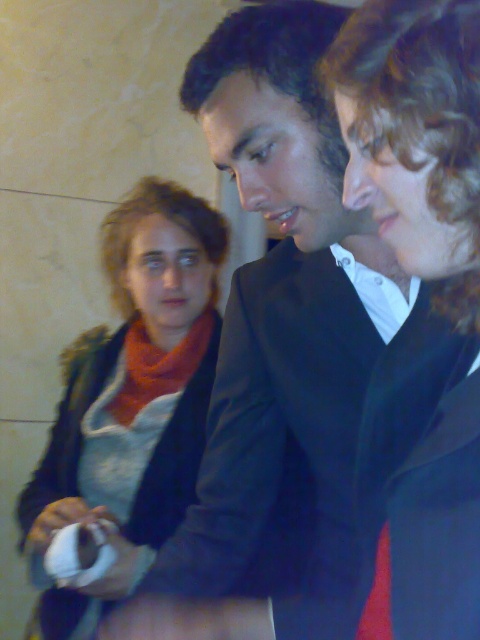
Question: From the image, what is the correct spatial relationship of matte black jacket at center in relation to matte orange scarf at upper left?

Choices:
 (A) above
 (B) below

Answer: (A)

Question: Which object is farther from the camera taking this photo?

Choices:
 (A) matte black jacket at center
 (B) matte orange scarf at upper left

Answer: (B)

Question: In this image, where is matte black jacket at center located relative to matte orange scarf at upper left?

Choices:
 (A) above
 (B) below

Answer: (A)

Question: Is matte black jacket at center bigger than matte orange scarf at upper left?

Choices:
 (A) no
 (B) yes

Answer: (A)

Question: Among these objects, which one is nearest to the camera?

Choices:
 (A) matte black jacket at center
 (B) matte orange scarf at upper left

Answer: (A)

Question: Which of the following is the farthest from the observer?

Choices:
 (A) matte black jacket at center
 (B) matte orange scarf at upper left

Answer: (B)